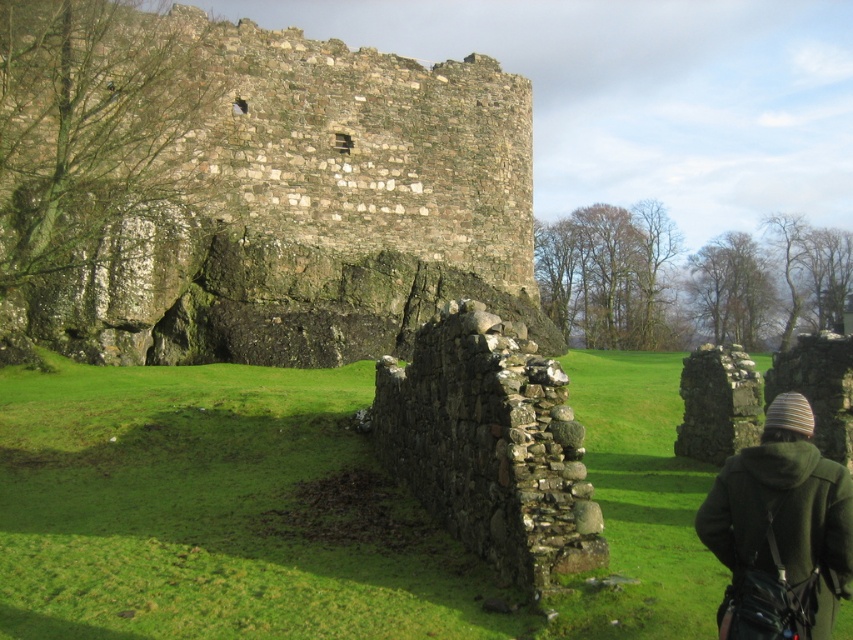
You are an archaeologist examining the historical site. You notice the rustic stone wall at upper left and the striped woolen hat at lower right. Which object is wider?

The rustic stone wall at upper left is wider than the striped woolen hat at lower right.